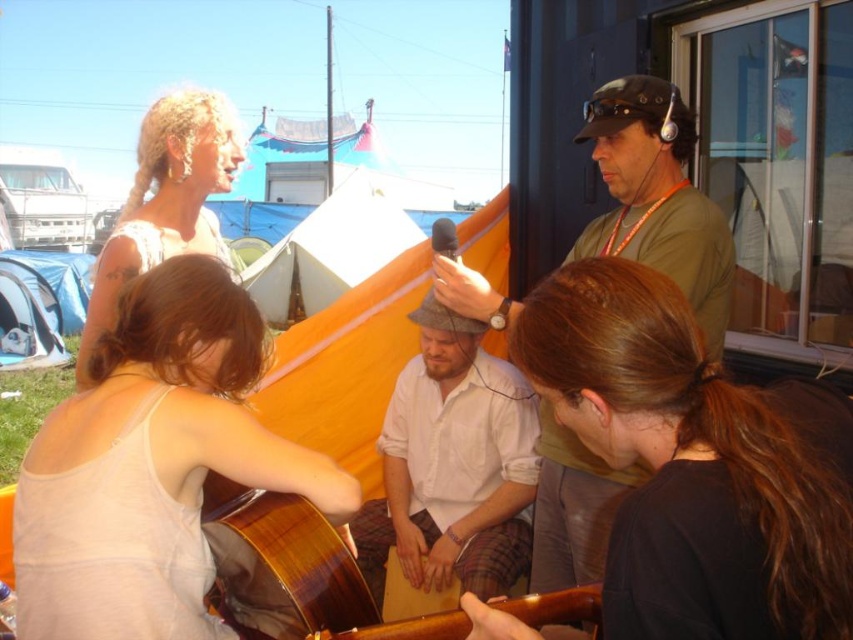
You are at a festival and want to take a photo of the white cotton shirt at center and the wooden guitar at center. Which one is positioned higher in the image?

The white cotton shirt at center is located above the wooden guitar at center, so it is positioned higher in the image.